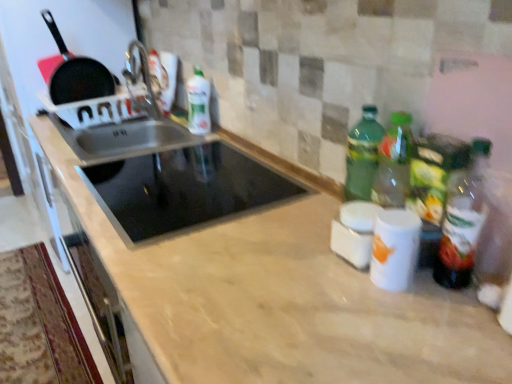
Question: Relative to green matte bottle at upper center, the first bottle viewed from the top, is green glass bottle at right, acting as the 1th bottle starting from the right, in front or behind?

Choices:
 (A) behind
 (B) front

Answer: (B)

Question: In terms of height, does green glass bottle at right, acting as the 1th bottle starting from the bottom, look taller or shorter compared to green matte bottle at upper center, which is counted as the second bottle, starting from the right?

Choices:
 (A) short
 (B) tall

Answer: (B)

Question: Considering the real-world distances, which object is farthest from the black glass cooktop at center?

Choices:
 (A) green glass bottle at right, acting as the 1th bottle starting from the bottom
 (B) green matte bottle at upper center, which is counted as the second bottle, starting from the right
 (C) black matte frying pan at upper left

Answer: (C)

Question: Which object is positioned farthest from the green matte bottle at upper center, acting as the 2th bottle starting from the front?

Choices:
 (A) black glass cooktop at center
 (B) green glass bottle at right, acting as the 1th bottle starting from the right
 (C) black matte frying pan at upper left

Answer: (B)